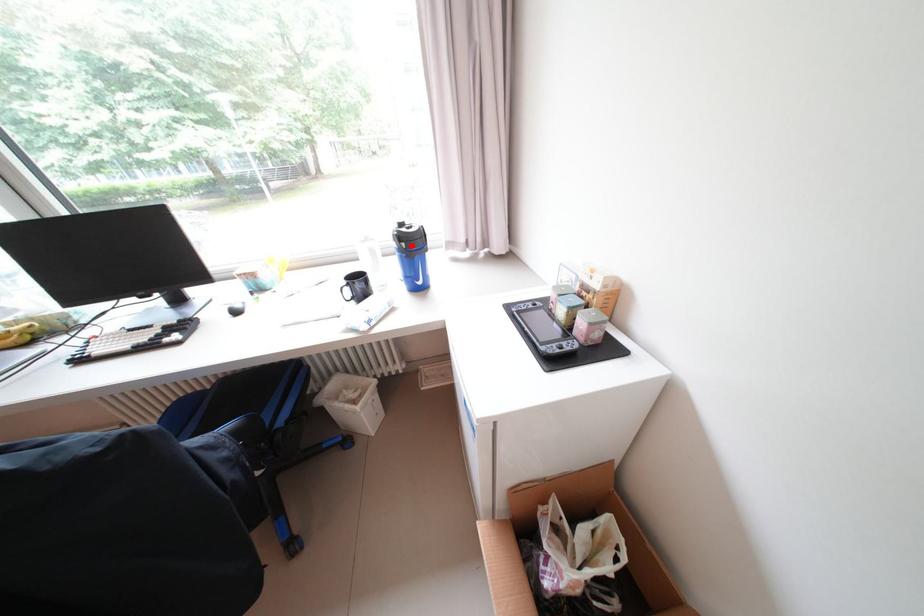
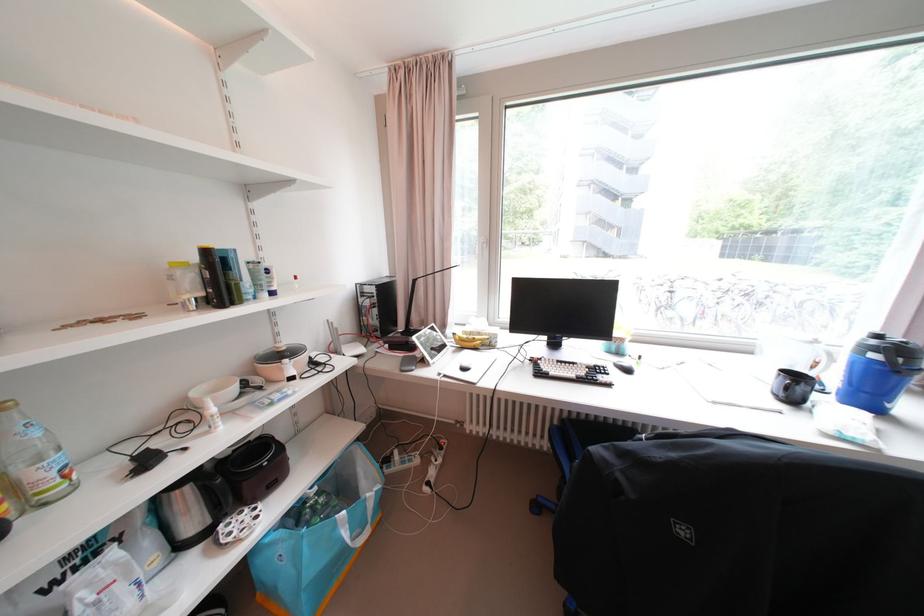
In the second image, find the point that corresponds to the highlighted location in the first image.

(909, 361)